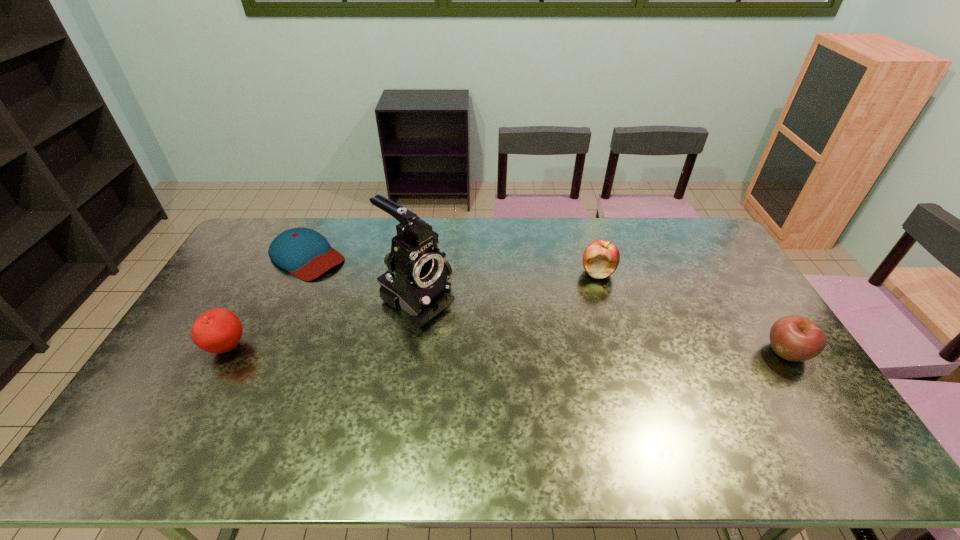
What are the coordinates of `apple that stands as the closest to the leftmost apple` in the screenshot? It's located at (601, 258).

Identify which apple is located as the second nearest to the leftmost apple. Please provide its 2D coordinates. Your answer should be formatted as a tuple, i.e. [(x, y)], where the tuple contains the x and y coordinates of a point satisfying the conditions above.

[(795, 338)]

At what (x,y) coordinates should I click in order to perform the action: click on free space that satisfies the following two spatial constraints: 1. on the back side of the leftmost apple; 2. on the right side of the third object from right to left. Please return your answer as a coordinate pair (x, y). Looking at the image, I should click on (252, 302).